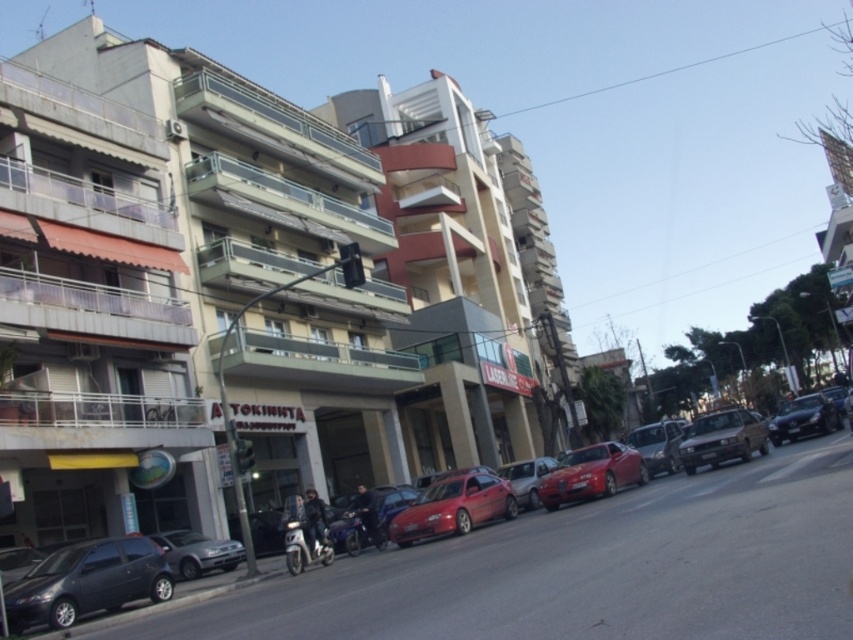
You are a delivery driver who needs to park your vehicle between the metallic silver sedan at center and the silver metallic sedan at lower left. Can you fit your vehicle there if your vehicle is 1.8 meters tall?

The metallic silver sedan at center is taller than silver metallic sedan at lower left. The height of the taller vehicle is not specified, so it is uncertain if the space between them can accommodate a vehicle that is 1.8 meters tall.

You are a delivery person who needs to park your 6ft tall delivery van. You see the shiny red car at center and the shiny black sedan at right. Which parking spot between them would be suitable for your van?

The shiny black sedan at right is taller than the shiny red car at center, so the parking spot near the shiny black sedan at right may be suitable for your 6ft tall delivery van as it can accommodate taller vehicles.

You are standing at the center of the street and notice a matte black car at lower left. Based on its position, which direction should you walk to reach it?

The matte black car at lower left is located at point (86, 580), so you should walk towards the lower left direction to reach it.